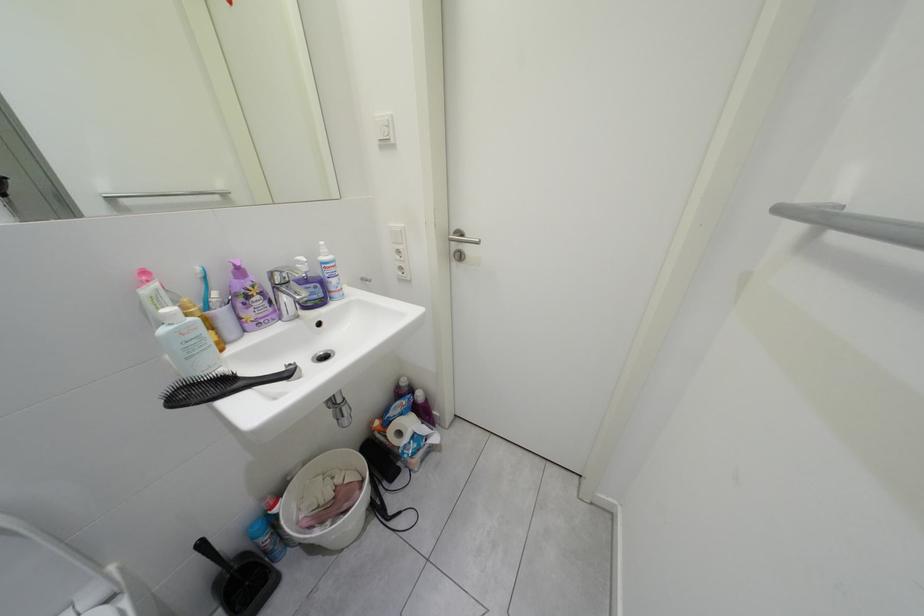
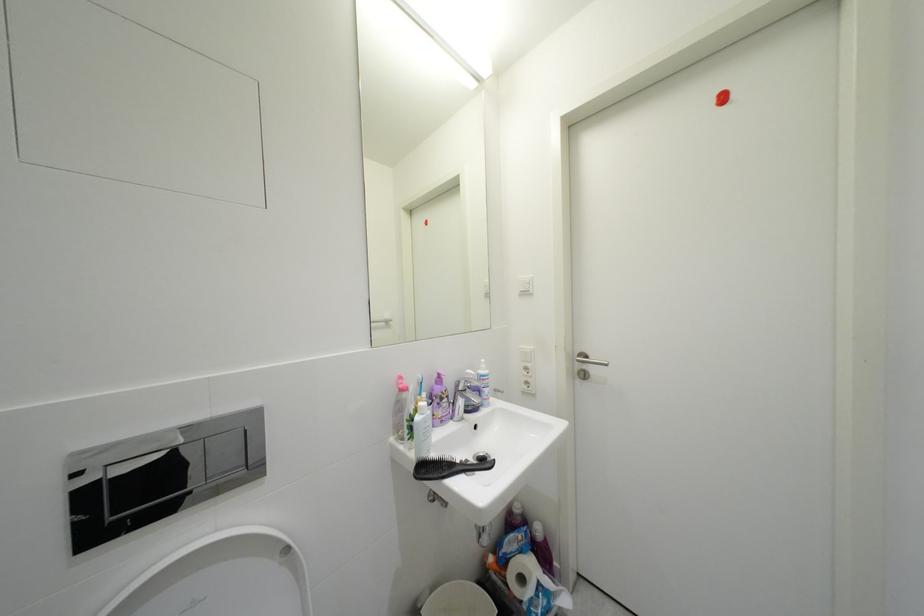
The images are taken continuously from a first-person perspective. In which direction are you moving?

The movement direction of the cameraman is left, backward.